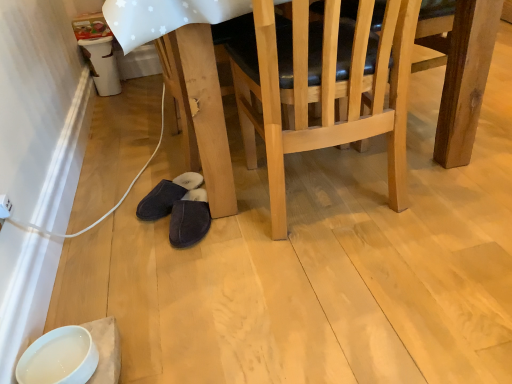
Identify the location of free location in front of natural wood chair at center. (355, 305).